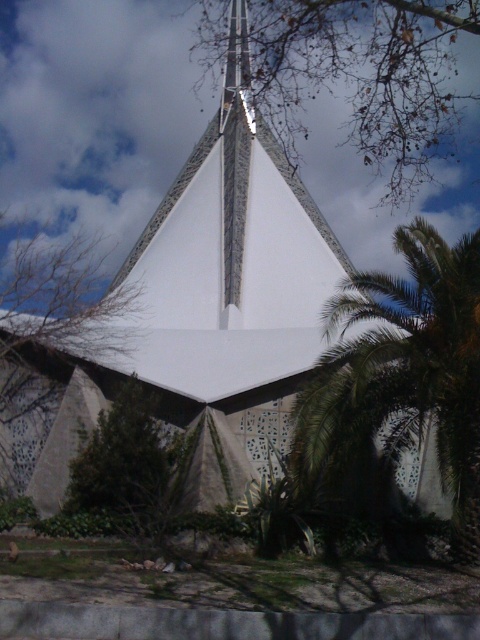
Looking at this image, does green leafy tree at center have a lesser width compared to green leafy tree at lower left?

No, green leafy tree at center is not thinner than green leafy tree at lower left.

Can you confirm if green leafy tree at center is shorter than green leafy tree at lower left?

Incorrect, green leafy tree at center's height does not fall short of green leafy tree at lower left's.

Which is behind, point (21, 262) or point (156, 499)?

The point (21, 262) is more distant.

Where is `green leafy tree at center`? This screenshot has height=640, width=480. green leafy tree at center is located at coordinates (51, 358).

Does brown leafy tree at upper center appear under green leafy tree at center?

No, brown leafy tree at upper center is not below green leafy tree at center.

Can you confirm if brown leafy tree at upper center is shorter than green leafy tree at center?

Incorrect, brown leafy tree at upper center's height does not fall short of green leafy tree at center's.

Where is `brown leafy tree at upper center`? The width and height of the screenshot is (480, 640). brown leafy tree at upper center is located at coordinates (364, 76).

Find the location of a particular element. The width and height of the screenshot is (480, 640). brown leafy tree at upper center is located at coordinates (364, 76).

Between green leafy palm tree at center and green leafy tree at center, which one is positioned higher?

green leafy palm tree at center

Can you confirm if green leafy palm tree at center is positioned above green leafy tree at center?

Yes.

At what (x,y) coordinates should I click in order to perform the action: click on green leafy palm tree at center. Please return your answer as a coordinate pair (x, y). Image resolution: width=480 pixels, height=640 pixels. Looking at the image, I should click on (x=406, y=371).